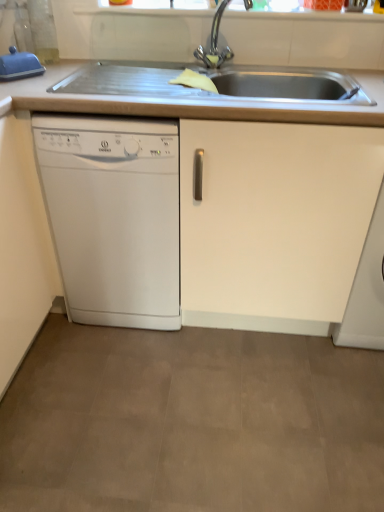
Question: Is blue rubber glove at upper left shorter than white matte countertop at upper center?

Choices:
 (A) no
 (B) yes

Answer: (B)

Question: Can you confirm if blue rubber glove at upper left is bigger than white matte countertop at upper center?

Choices:
 (A) yes
 (B) no

Answer: (B)

Question: Is blue rubber glove at upper left at the left side of white matte countertop at upper center?

Choices:
 (A) yes
 (B) no

Answer: (A)

Question: Is blue rubber glove at upper left next to white matte countertop at upper center?

Choices:
 (A) yes
 (B) no

Answer: (B)

Question: From the image's perspective, is blue rubber glove at upper left on white matte countertop at upper center?

Choices:
 (A) yes
 (B) no

Answer: (A)

Question: Looking at their shapes, would you say white matte countertop at upper center is wider or thinner than white matte cabinet at lower right?

Choices:
 (A) thin
 (B) wide

Answer: (A)

Question: Is white matte countertop at upper center bigger or smaller than white matte cabinet at lower right?

Choices:
 (A) small
 (B) big

Answer: (A)

Question: Relative to white matte cabinet at lower right, is white matte countertop at upper center in front or behind?

Choices:
 (A) front
 (B) behind

Answer: (A)

Question: Would you say white matte countertop at upper center is to the left or to the right of white matte cabinet at lower right in the picture?

Choices:
 (A) left
 (B) right

Answer: (A)

Question: Is polished chrome tap at upper center wider or thinner than white matte cabinet at lower right?

Choices:
 (A) wide
 (B) thin

Answer: (B)

Question: In terms of height, does polished chrome tap at upper center look taller or shorter compared to white matte cabinet at lower right?

Choices:
 (A) short
 (B) tall

Answer: (A)

Question: Is polished chrome tap at upper center spatially inside white matte cabinet at lower right, or outside of it?

Choices:
 (A) outside
 (B) inside

Answer: (A)

Question: From a real-world perspective, relative to white matte cabinet at lower right, is polished chrome tap at upper center vertically above or below?

Choices:
 (A) below
 (B) above

Answer: (B)

Question: Considering the positions of blue rubber glove at upper left and polished chrome tap at upper center in the image, is blue rubber glove at upper left taller or shorter than polished chrome tap at upper center?

Choices:
 (A) short
 (B) tall

Answer: (A)

Question: Looking at the image, does blue rubber glove at upper left seem bigger or smaller compared to polished chrome tap at upper center?

Choices:
 (A) big
 (B) small

Answer: (B)